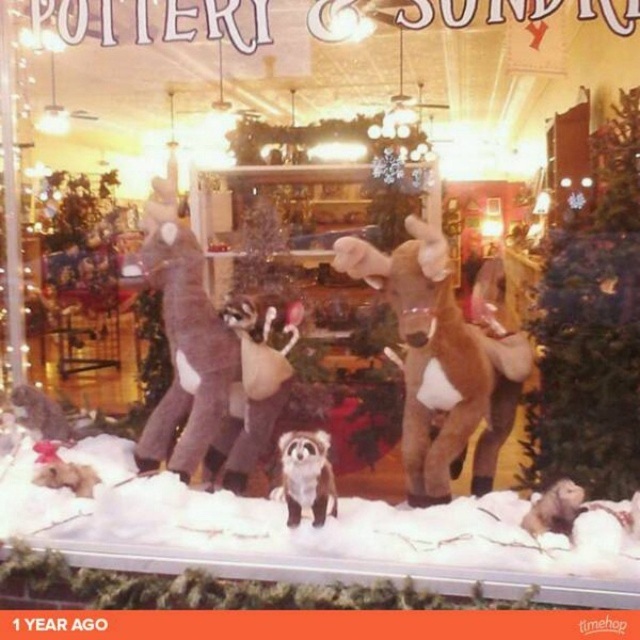
Question: Is white fluffy snow at center below fuzzy brown raccoon at center?

Choices:
 (A) no
 (B) yes

Answer: (B)

Question: Can you confirm if white fluffy snow at center is wider than fuzzy brown raccoon at center?

Choices:
 (A) yes
 (B) no

Answer: (A)

Question: Is fuzzy brown raccoon at center behind fuzzy brown raccoon at lower right?

Choices:
 (A) no
 (B) yes

Answer: (B)

Question: Which object is positioned closest to the fuzzy brown raccoon at center?

Choices:
 (A) white fluffy snow at center
 (B) brown plush reindeer at center

Answer: (A)

Question: Estimate the real-world distances between objects in this image. Which object is farther from the white fluffy snow at center?

Choices:
 (A) fuzzy brown raccoon at center
 (B) fuzzy brown raccoon at lower right
 (C) brown plush reindeer at center

Answer: (C)

Question: Which object is farther from the camera taking this photo?

Choices:
 (A) brown plush reindeer at center
 (B) white fluffy snow at center
 (C) fuzzy brown raccoon at lower right
 (D) fuzzy brown raccoon at center

Answer: (D)